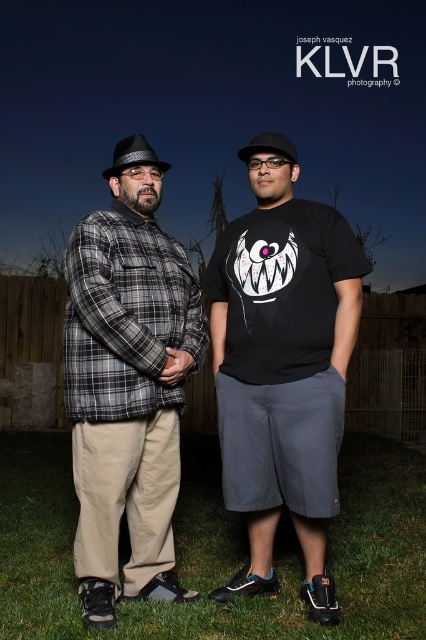
Can you confirm if matte black t-shirt at center is positioned to the right of plaid fabric shirt at left?

Correct, you'll find matte black t-shirt at center to the right of plaid fabric shirt at left.

Is matte black t-shirt at center smaller than plaid fabric shirt at left?

No.

Does point (307, 593) come in front of point (101, 300)?

That is False.

Where is `matte black t-shirt at center`? matte black t-shirt at center is located at coordinates (284, 364).